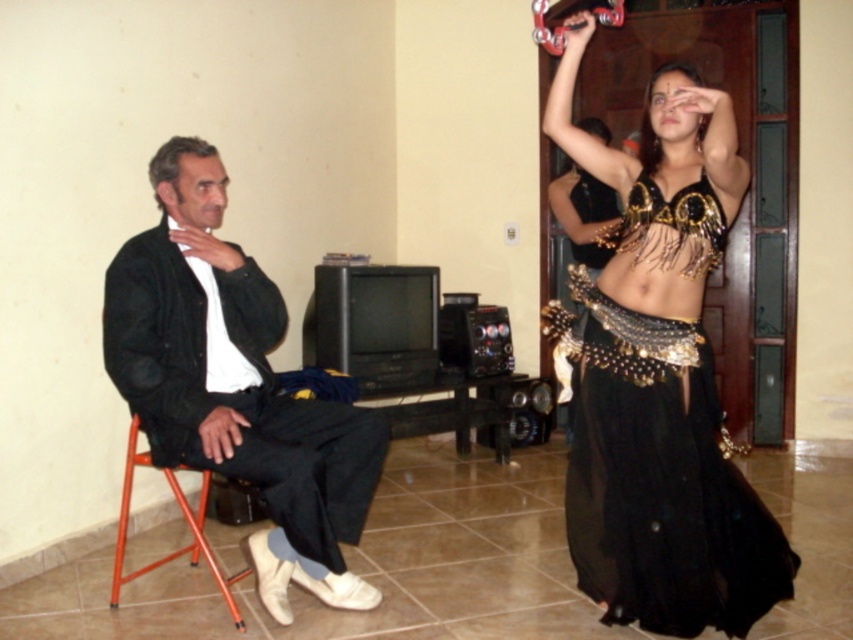
You are a photographer positioned in front of the scene. You need to capture a photo where both the black satin belly dancer at upper right and the black fabric jacket at left are clearly visible. Based on their positions, which object should you focus on first to ensure both are in frame?

The black satin belly dancer at upper right is located above the black fabric jacket at left. To ensure both are in frame, focus on the black satin belly dancer at upper right first as it is higher up, then adjust the camera angle downward to include the black fabric jacket at left.

You are a photographer trying to capture the shiny gold sequins at upper right and the black fabric jacket at left in the same frame. Based on their positions, which object is closer to the bottom of the image?

The black fabric jacket at left is positioned under the shiny gold sequins at upper right, so it is closer to the bottom of the image.

You are a photographer setting up for a photo shoot. You need to position a light source between the black satin belly dancer at upper right and the black fabric jacket at left. Based on their positions, which side of the light source should face the dancer and which side should face the jacket?

The black satin belly dancer at upper right is positioned on the right side of the black fabric jacket at left, so the light source should have its right side facing the dancer and the left side facing the jacket.